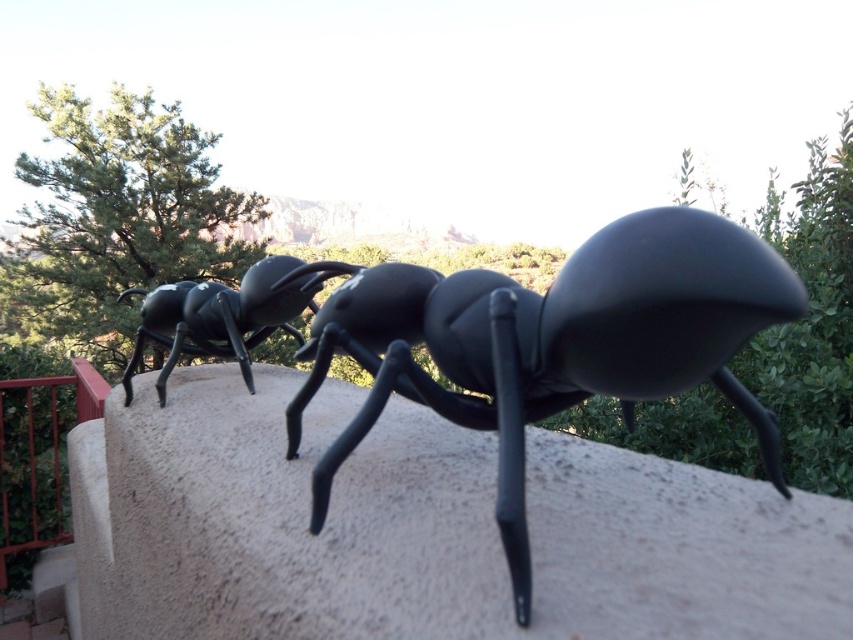
Does glossy black ant at center appear under matte black ant at center?

Indeed, glossy black ant at center is positioned under matte black ant at center.

Can you confirm if glossy black ant at center is shorter than matte black ant at center?

In fact, glossy black ant at center may be taller than matte black ant at center.

Is point (505, 502) positioned after point (268, 323)?

No, (505, 502) is in front of (268, 323).

The width and height of the screenshot is (853, 640). I want to click on glossy black ant at center, so click(x=506, y=339).